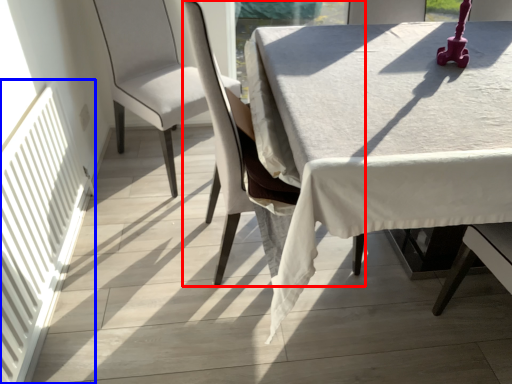
Question: Among these objects, which one is farthest to the camera, chair (highlighted by a red box) or radiator (highlighted by a blue box)?

Choices:
 (A) chair
 (B) radiator

Answer: (A)